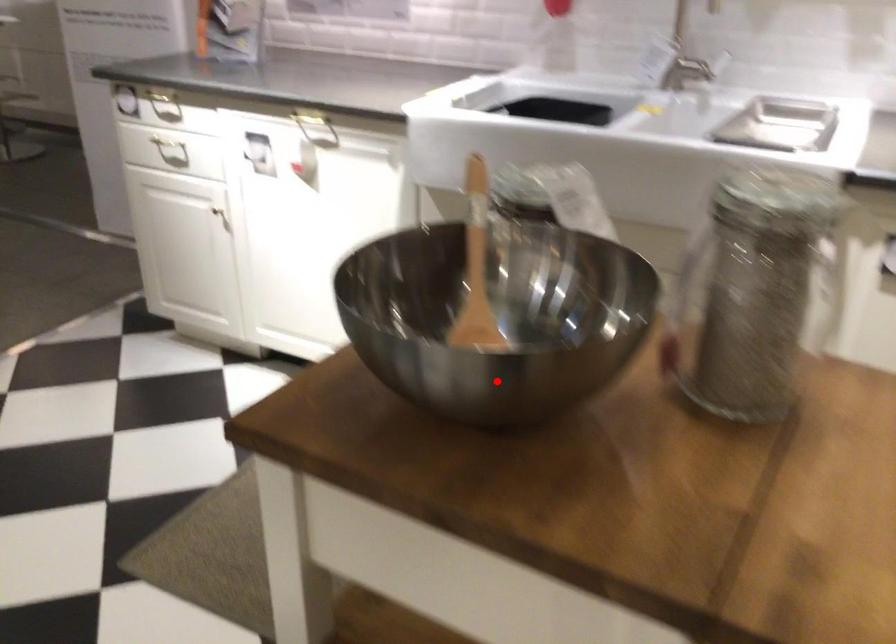
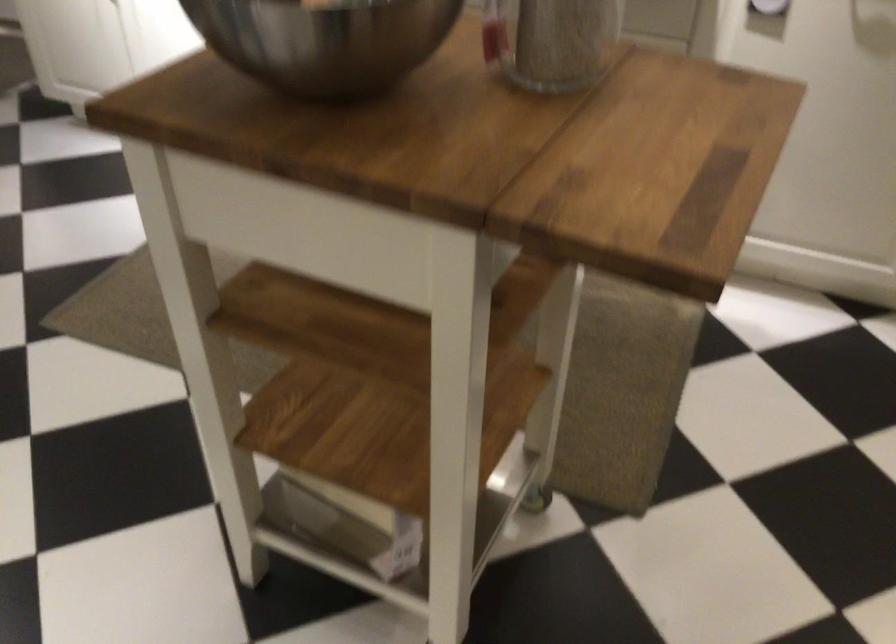
Find the pixel in the second image that matches the highlighted location in the first image.

(323, 41)